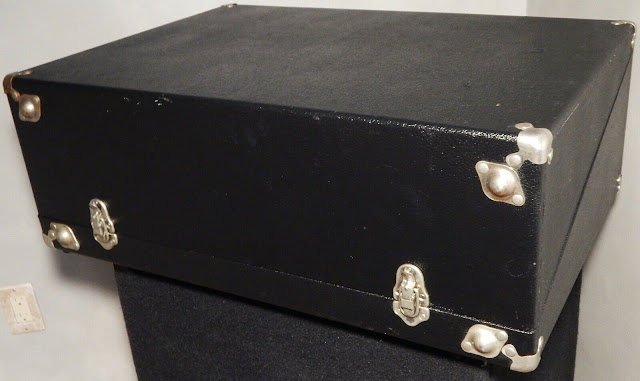
Identify the location of stand. pyautogui.click(x=319, y=373).